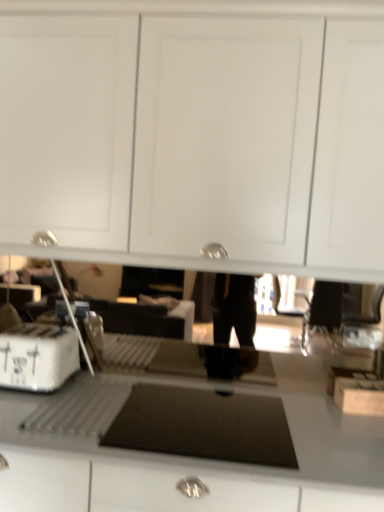
Question: Is white cardboard box at left in front of or behind smooth gray countertop at center in the image?

Choices:
 (A) behind
 (B) front

Answer: (A)

Question: Considering the positions of point (14, 387) and point (253, 490), is point (14, 387) closer or farther from the camera than point (253, 490)?

Choices:
 (A) farther
 (B) closer

Answer: (A)

Question: In terms of width, does white cardboard box at left look wider or thinner when compared to smooth gray countertop at center?

Choices:
 (A) wide
 (B) thin

Answer: (B)

Question: Considering the positions of smooth gray countertop at center and white cardboard box at left in the image, is smooth gray countertop at center wider or thinner than white cardboard box at left?

Choices:
 (A) wide
 (B) thin

Answer: (A)

Question: In terms of height, does smooth gray countertop at center look taller or shorter compared to white cardboard box at left?

Choices:
 (A) tall
 (B) short

Answer: (A)

Question: Visually, is smooth gray countertop at center positioned to the left or to the right of white cardboard box at left?

Choices:
 (A) left
 (B) right

Answer: (B)

Question: From the image's perspective, is smooth gray countertop at center positioned above or below white cardboard box at left?

Choices:
 (A) below
 (B) above

Answer: (A)